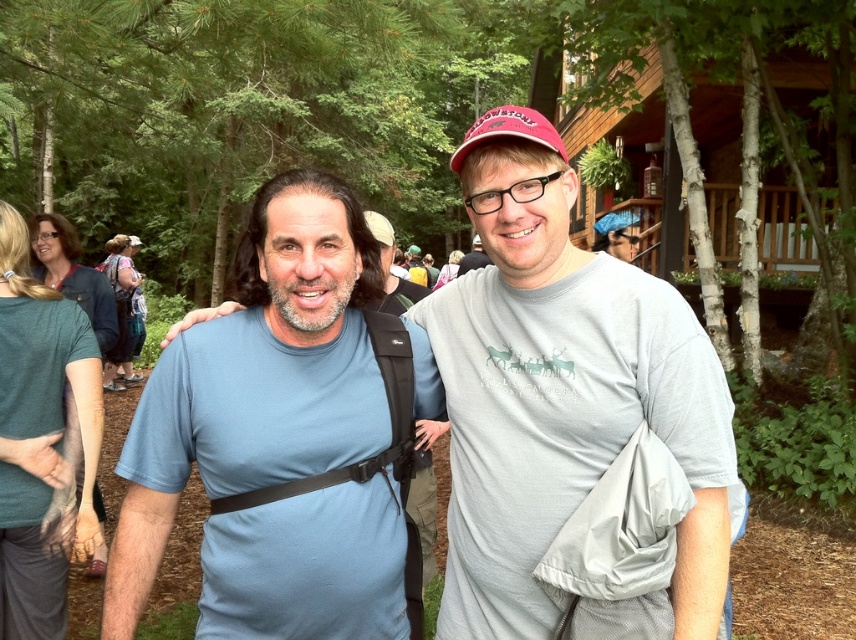
Question: Does blue fabric cap at upper center have a larger size compared to matte gray t-shirt at center?

Choices:
 (A) yes
 (B) no

Answer: (B)

Question: Does denim jacket at upper left come behind matte pink fabric at center?

Choices:
 (A) yes
 (B) no

Answer: (A)

Question: Among these points, which one is nearest to the camera?

Choices:
 (A) (201, 394)
 (B) (68, 292)

Answer: (A)

Question: Which of the following is the farthest from the observer?

Choices:
 (A) (58, 289)
 (B) (551, 385)
 (C) (456, 252)

Answer: (C)

Question: Is green fabric shirt at left bigger than matte pink fabric at center?

Choices:
 (A) no
 (B) yes

Answer: (A)

Question: Which point is farther to the camera?

Choices:
 (A) (626, 248)
 (B) (461, 268)
 (C) (456, 266)
 (D) (138, 243)

Answer: (C)